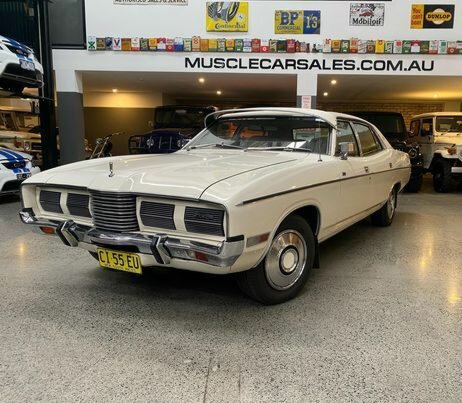
You are a GUI agent. You are given a task and a screenshot of the screen. Output one action in this format:
    pyautogui.click(x=<x>, y=<y>)
    Task: Click on the mirror
    
    Given the screenshot: What is the action you would take?
    pyautogui.click(x=354, y=155), pyautogui.click(x=427, y=135)